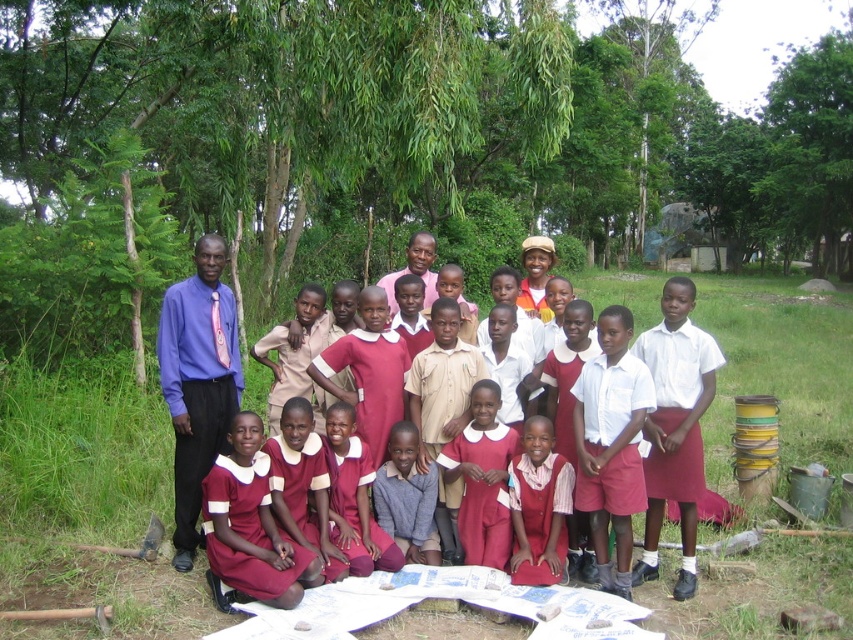
Question: Can you confirm if green leafy tree at center is bigger than white cotton shirt at center?

Choices:
 (A) yes
 (B) no

Answer: (A)

Question: Can you confirm if green leafy tree at center is positioned to the right of white cotton shirt at center?

Choices:
 (A) no
 (B) yes

Answer: (B)

Question: Among these objects, which one is farthest from the camera?

Choices:
 (A) pink fabric shirt at center
 (B) green leafy tree at center
 (C) white cotton shirt at center

Answer: (B)

Question: Which object is the closest to the purple smooth shirt at center?

Choices:
 (A) green leafy tree at upper center
 (B) white cotton shirt at center
 (C) maroon dress at center

Answer: (C)

Question: Does purple smooth shirt at center lie in front of white cotton shirt at center?

Choices:
 (A) no
 (B) yes

Answer: (A)

Question: Based on their relative distances, which object is farther from the green leafy tree at center?

Choices:
 (A) pink fabric shirt at center
 (B) maroon dress at center
 (C) white cotton shirt at center
 (D) purple smooth shirt at center

Answer: (B)